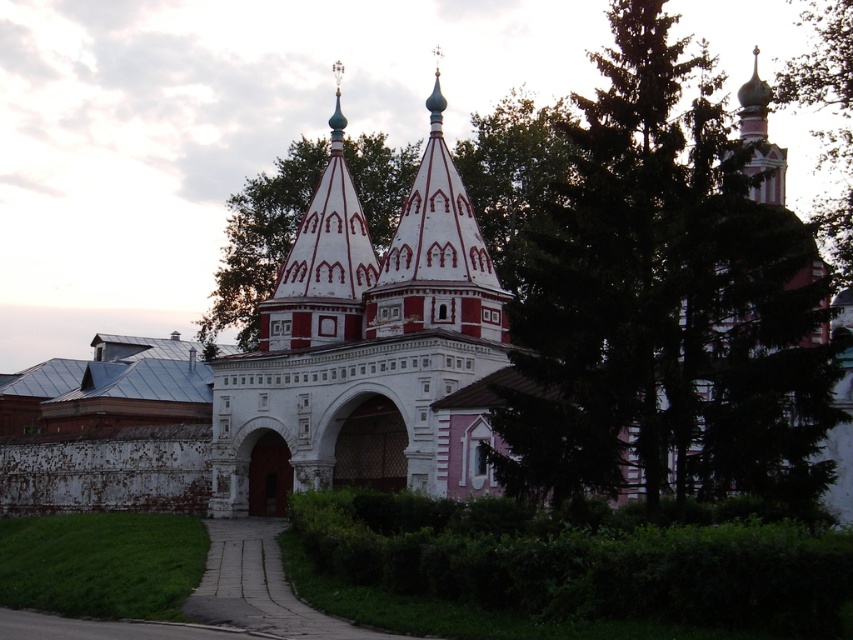
Question: Is green textured tree at center to the right of white stone church at center from the viewer's perspective?

Choices:
 (A) yes
 (B) no

Answer: (A)

Question: Among these objects, which one is farthest from the camera?

Choices:
 (A) green textured tree at center
 (B) red painted wood spire at center
 (C) white stone church at center
 (D) green leafy tree at upper right

Answer: (B)

Question: Does green textured tree at center appear under green leafy tree at upper right?

Choices:
 (A) yes
 (B) no

Answer: (A)

Question: Among these objects, which one is nearest to the camera?

Choices:
 (A) green leafy tree at upper right
 (B) red painted wood spire at center
 (C) green textured tree at center
 (D) white stone church at center

Answer: (C)

Question: Which point is farther from the camera taking this photo?

Choices:
 (A) (456, 216)
 (B) (521, 364)
 (C) (373, 349)
 (D) (849, 154)

Answer: (D)

Question: Considering the relative positions of white stone church at center and red painted wood spire at center in the image provided, where is white stone church at center located with respect to red painted wood spire at center?

Choices:
 (A) below
 (B) above

Answer: (B)